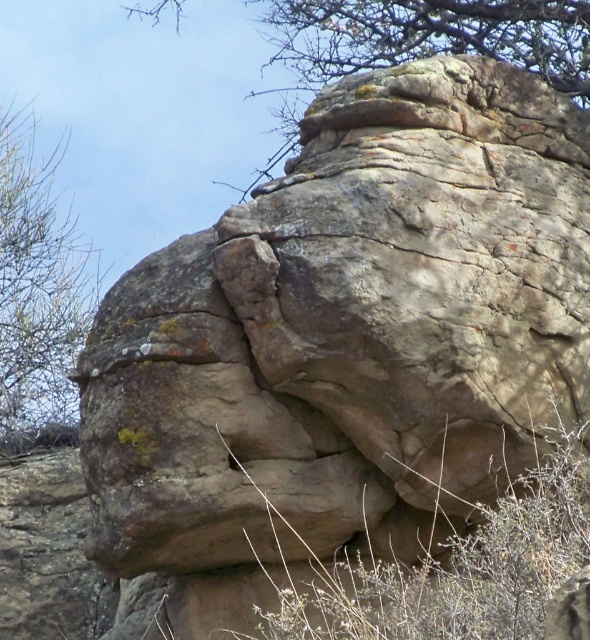
Question: Is green mossy rock at upper center behind green leafy tree at upper left?

Choices:
 (A) yes
 (B) no

Answer: (B)

Question: Which object is closer to the camera taking this photo?

Choices:
 (A) green mossy rock at upper center
 (B) gray rough rock at center

Answer: (B)

Question: Does green mossy rock at upper center have a greater width compared to green leafy tree at upper left?

Choices:
 (A) yes
 (B) no

Answer: (A)

Question: Which point is farther to the camera?

Choices:
 (A) gray rough rock at center
 (B) green leafy tree at upper left
 (C) green mossy rock at upper center

Answer: (B)

Question: Which object appears closest to the camera in this image?

Choices:
 (A) gray rough rock at center
 (B) green mossy rock at upper center

Answer: (A)

Question: Is green mossy rock at upper center to the right of green leafy tree at upper left from the viewer's perspective?

Choices:
 (A) yes
 (B) no

Answer: (A)